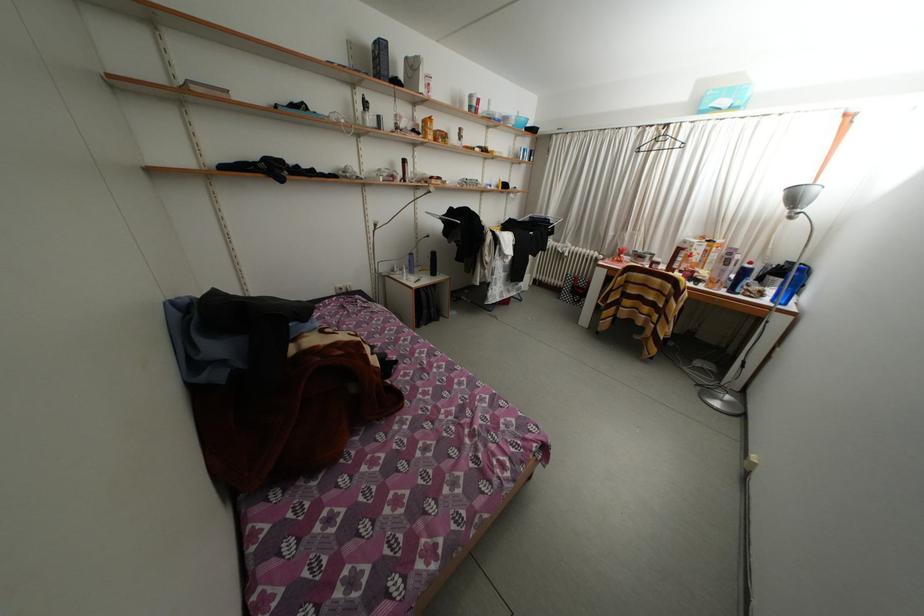
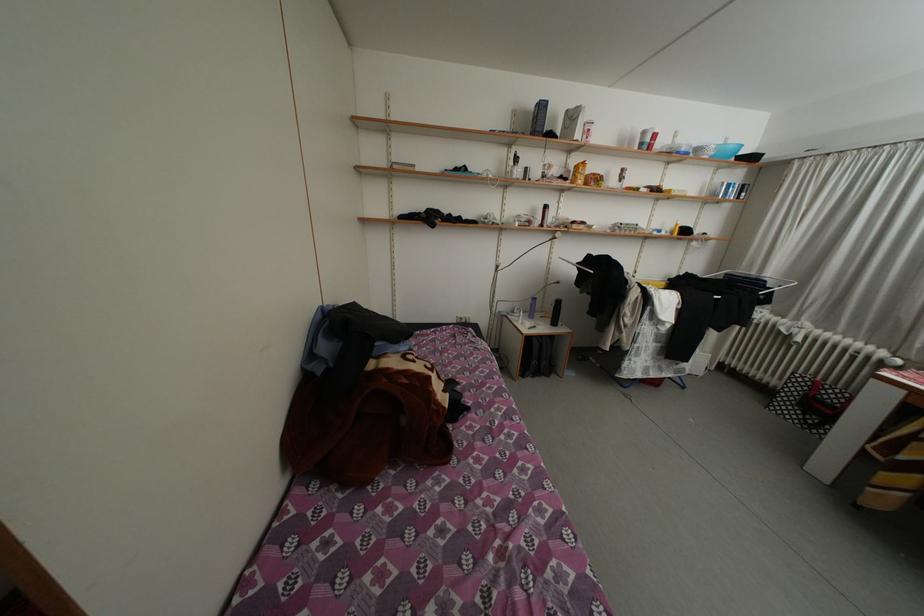
Find the pixel in the second image that matches point (458, 214) in the first image.

(597, 262)